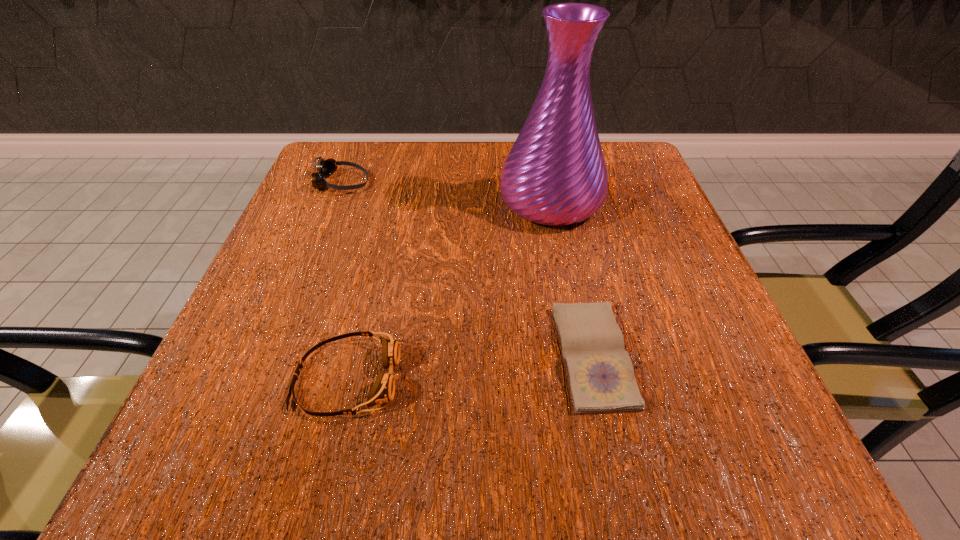
Identify the location of vacant region at the left edge. The width and height of the screenshot is (960, 540). (376, 205).

You are a GUI agent. You are given a task and a screenshot of the screen. Output one action in this format:
    pyautogui.click(x=<x>, y=<y>)
    Task: Click on the vacant space at the right edge of the desktop
    This screenshot has height=540, width=960.
    Given the screenshot: What is the action you would take?
    pyautogui.click(x=715, y=335)

I want to click on vacant space at the far left corner of the desktop, so click(x=380, y=147).

In the image, there is a desktop. Where is `free space at the far right corner`? free space at the far right corner is located at coordinates (631, 196).

You are a GUI agent. You are given a task and a screenshot of the screen. Output one action in this format:
    pyautogui.click(x=<x>, y=<y>)
    Task: Click on the free area in between the farther goggles and the tallest object
    
    Given the screenshot: What is the action you would take?
    pyautogui.click(x=446, y=192)

I want to click on unoccupied position between the vase and the shortest object, so click(x=572, y=279).

Where is `free point between the farther goggles and the diary`? The width and height of the screenshot is (960, 540). free point between the farther goggles and the diary is located at coordinates (468, 269).

Identify the location of vacant space that is in between the farther goggles and the shortest object. Image resolution: width=960 pixels, height=540 pixels. (468, 269).

Where is `vacant area that lies between the nearer goggles and the vase`? Image resolution: width=960 pixels, height=540 pixels. vacant area that lies between the nearer goggles and the vase is located at coordinates (448, 290).

This screenshot has height=540, width=960. What are the coordinates of `free spot between the nearer goggles and the tallest object` in the screenshot? It's located at click(448, 290).